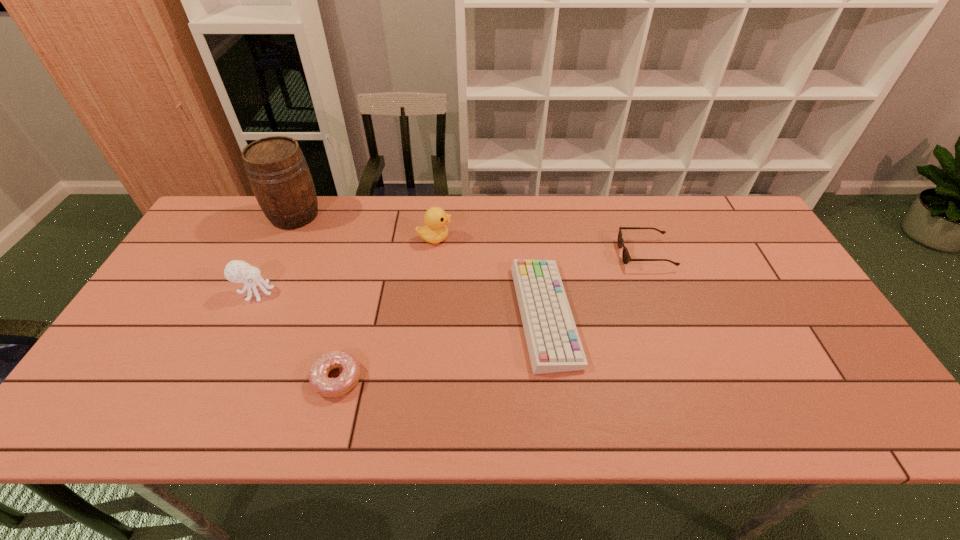
In the image, there is a desktop. Where is `vacant space at the left edge`? vacant space at the left edge is located at coordinates (171, 335).

At what (x,y) coordinates should I click in order to perform the action: click on vacant space at the right edge of the desktop. Please return your answer as a coordinate pair (x, y). This screenshot has height=540, width=960. Looking at the image, I should click on (737, 249).

Where is `vacant area at the far right corner of the desktop`? The width and height of the screenshot is (960, 540). vacant area at the far right corner of the desktop is located at coordinates (743, 208).

Image resolution: width=960 pixels, height=540 pixels. What are the coordinates of `empty space between the computer keyboard and the sunglasses` in the screenshot? It's located at (595, 285).

This screenshot has height=540, width=960. I want to click on blank region between the doughnut and the tallest object, so click(x=316, y=297).

At what (x,y) coordinates should I click in order to perform the action: click on vacant point located between the computer keyboard and the rightmost object. Please return your answer as a coordinate pair (x, y). This screenshot has height=540, width=960. Looking at the image, I should click on (595, 285).

You are a GUI agent. You are given a task and a screenshot of the screen. Output one action in this format:
    pyautogui.click(x=<x>, y=<y>)
    Task: Click on the empty space between the computer keyboard and the rightmost object
    The width and height of the screenshot is (960, 540).
    Given the screenshot: What is the action you would take?
    pyautogui.click(x=595, y=285)

You are a GUI agent. You are given a task and a screenshot of the screen. Output one action in this format:
    pyautogui.click(x=<x>, y=<y>)
    Task: Click on the unoccupied area between the doughnut and the octopus
    The width and height of the screenshot is (960, 540).
    Given the screenshot: What is the action you would take?
    pyautogui.click(x=297, y=335)

In order to click on free space between the rightmost object and the fourth object from left to right in this screenshot , I will do `click(540, 246)`.

This screenshot has height=540, width=960. What are the coordinates of `vacant space that is in between the sunglasses and the fifth object from left to right` in the screenshot? It's located at (595, 285).